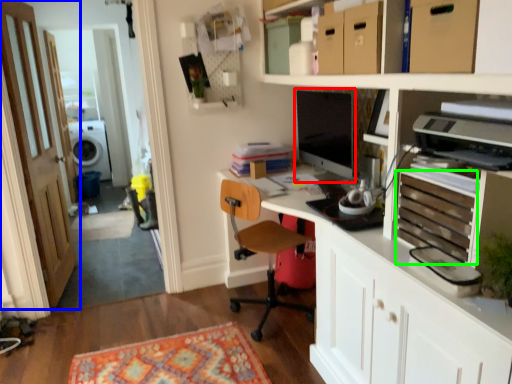
Question: Estimate the real-world distances between objects in this image. Which object is closer to computer monitor (highlighted by a red box), door (highlighted by a blue box) or drawer (highlighted by a green box)?

Choices:
 (A) door
 (B) drawer

Answer: (B)